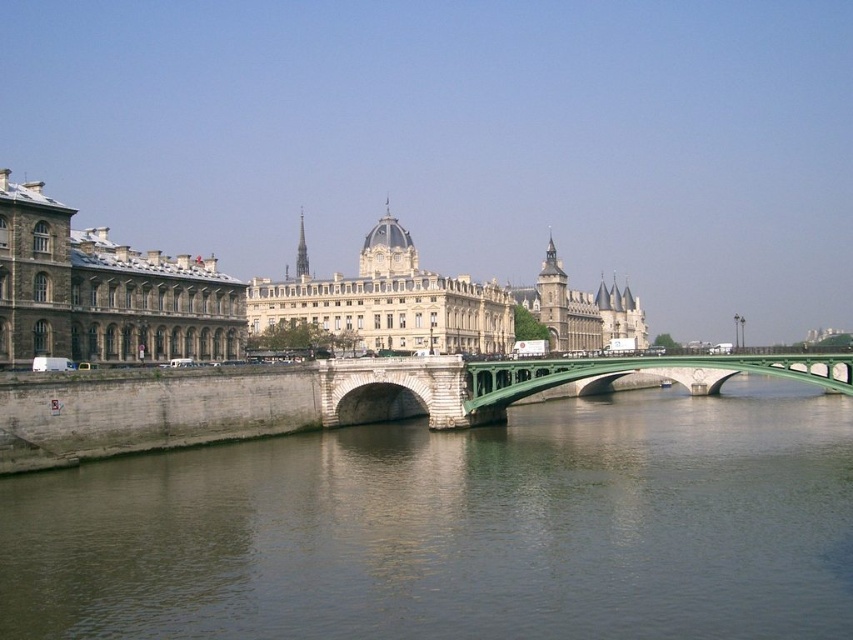
Question: Which is farther from the beige stone building at center?

Choices:
 (A) green stone river at center
 (B) stone building at left
 (C) green stone bridge at center

Answer: (A)

Question: Which object is closer to the camera taking this photo?

Choices:
 (A) beige stone building at center
 (B) stone building at left
 (C) green stone river at center
 (D) green stone bridge at center

Answer: (C)

Question: Observing the image, what is the correct spatial positioning of beige stone building at center in reference to stone building at left?

Choices:
 (A) right
 (B) left

Answer: (A)

Question: Can you confirm if beige stone building at center is positioned above green stone bridge at center?

Choices:
 (A) no
 (B) yes

Answer: (B)

Question: Which is farther from the beige stone building at center?

Choices:
 (A) stone building at left
 (B) green stone bridge at center
 (C) green stone river at center

Answer: (C)

Question: Is beige stone building at center below green stone bridge at center?

Choices:
 (A) yes
 (B) no

Answer: (B)